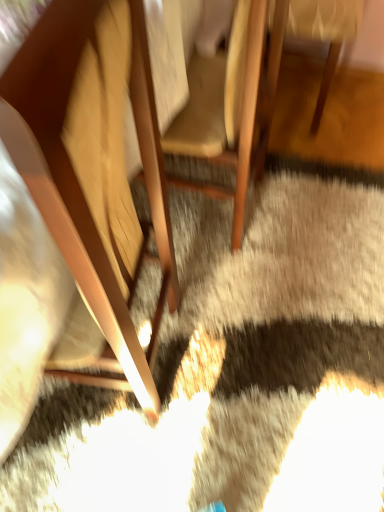
Question: In terms of width, does wooden chair at center, the second chair in the right-to-left sequence, look wider or thinner when compared to wooden chair at center, the 1th chair positioned from the right?

Choices:
 (A) thin
 (B) wide

Answer: (A)

Question: In the image, is wooden chair at center, which appears as the second chair when viewed from the left, positioned in front of or behind wooden chair at center, the 1th chair positioned from the right?

Choices:
 (A) behind
 (B) front

Answer: (B)

Question: Which of these objects is positioned farthest from the wooden chair at left, the 1th chair viewed from the left?

Choices:
 (A) wooden chair at center, which appears as the second chair when viewed from the left
 (B) wooden chair at center, placed as the third chair when sorted from left to right

Answer: (B)

Question: Based on their relative distances, which object is farther from the wooden chair at left, the 1th chair viewed from the left?

Choices:
 (A) wooden chair at center, which appears as the second chair when viewed from the left
 (B) wooden chair at center, the 1th chair positioned from the right

Answer: (B)